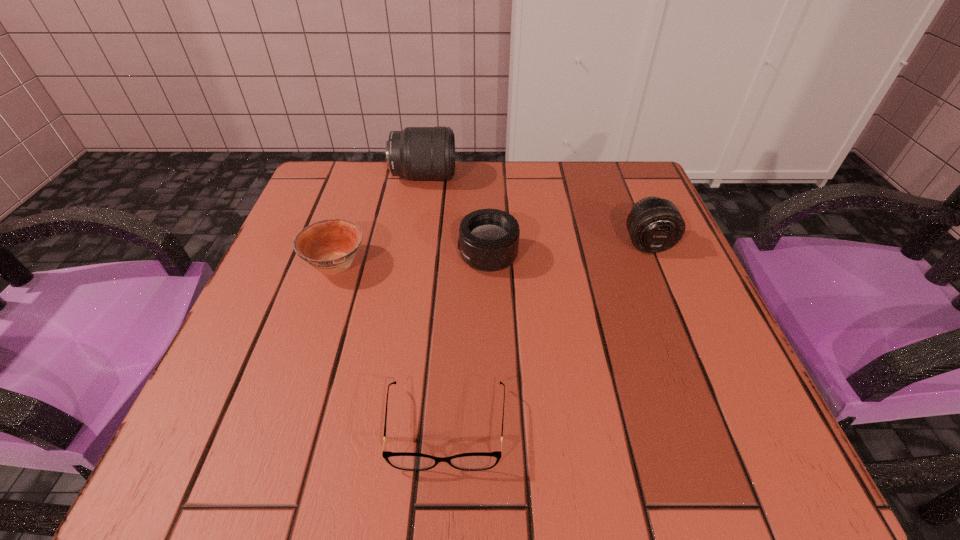
Identify the location of the farthest object. pyautogui.click(x=418, y=153).

At what (x,y) coordinates should I click in order to perform the action: click on the farthest telephoto lens. Please return your answer as a coordinate pair (x, y). Looking at the image, I should click on (418, 153).

This screenshot has width=960, height=540. Find the location of `the second tallest telephoto lens`. the second tallest telephoto lens is located at coordinates (654, 224).

Locate an element on the screen. This screenshot has height=540, width=960. the fourth shortest object is located at coordinates (654, 224).

You are a GUI agent. You are given a task and a screenshot of the screen. Output one action in this format:
    pyautogui.click(x=<x>, y=<y>)
    Task: Click on the shortest telephoto lens
    
    Given the screenshot: What is the action you would take?
    pyautogui.click(x=488, y=240)

Image resolution: width=960 pixels, height=540 pixels. Find the location of `bowl`. bowl is located at coordinates (330, 246).

Locate an element on the screen. This screenshot has width=960, height=540. the shortest object is located at coordinates (477, 461).

The width and height of the screenshot is (960, 540). What are the coordinates of `the nearest object` in the screenshot? It's located at (477, 461).

The width and height of the screenshot is (960, 540). What are the coordinates of `vacant region located on the surface of the tallest telephoto lens` in the screenshot? It's located at (580, 177).

This screenshot has width=960, height=540. Identify the location of vacant area situated 0.290m on the front-facing side of the rightmost object. (705, 384).